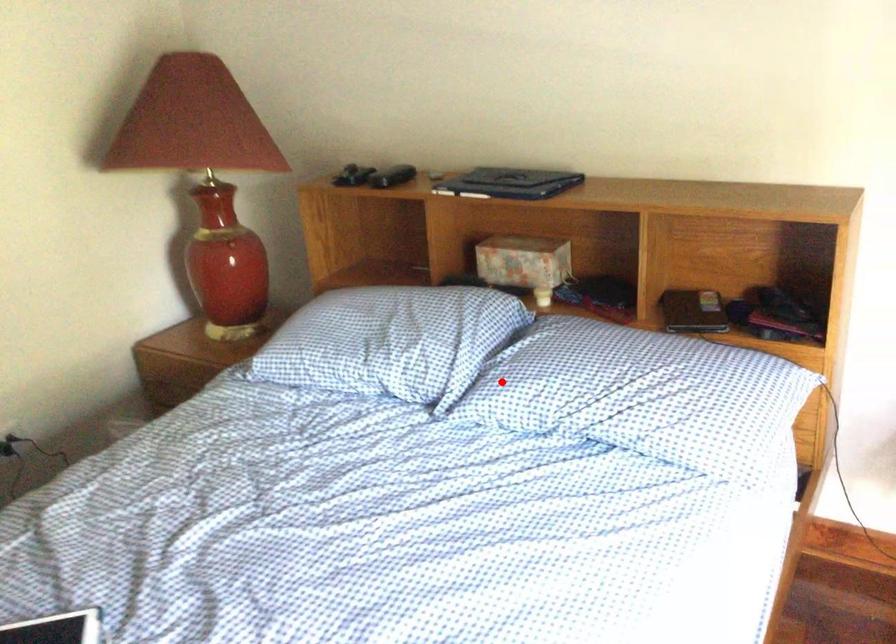
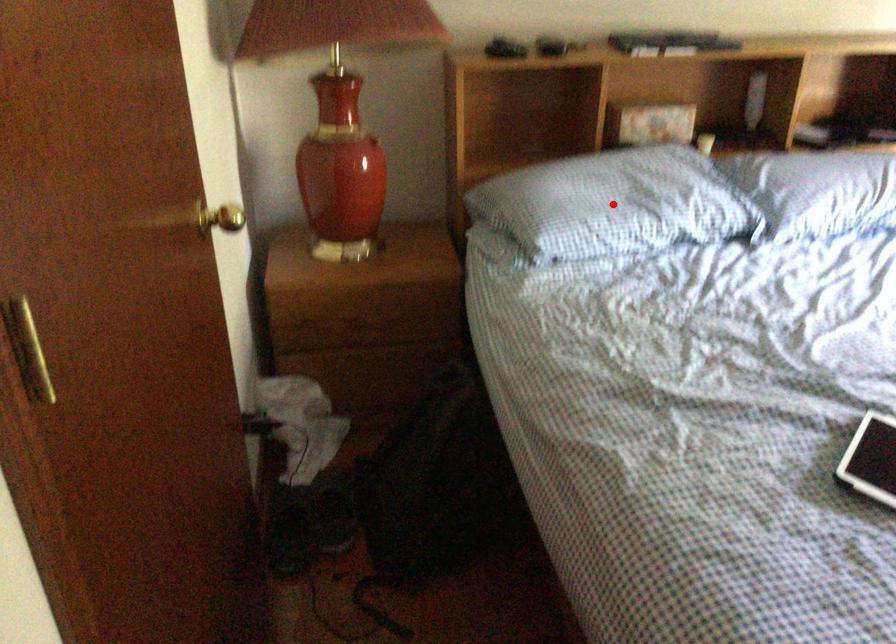
I am providing you with two images of the same scene from different viewpoints. A red point is marked on the first image and another point is marked on the second image. Is the marked point in image1 the same physical position as the marked point in image2?

No